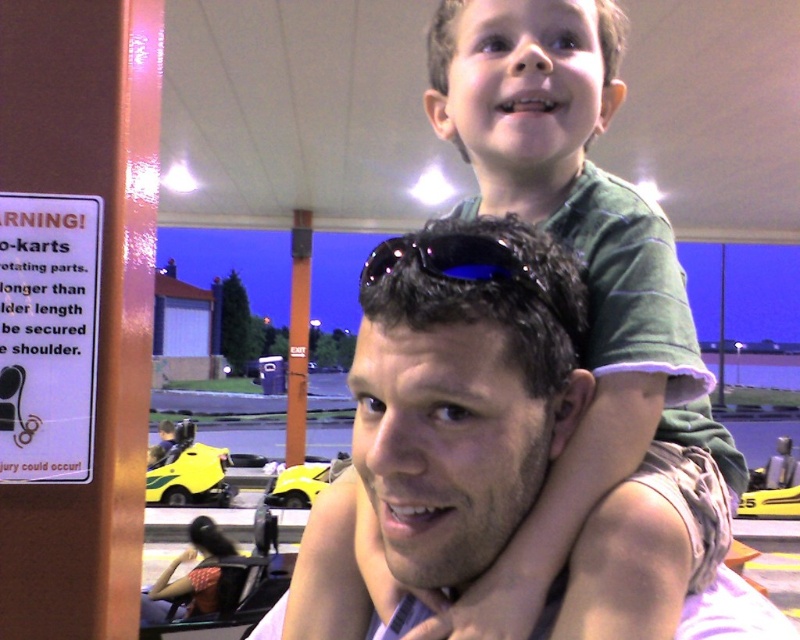
Question: Can you confirm if brown hair at upper center is positioned to the right of black reflective sunglasses at center?

Choices:
 (A) no
 (B) yes

Answer: (B)

Question: Which of these objects is positioned closest to the black reflective sunglasses at center?

Choices:
 (A) yellow plastic go-kart at center
 (B) yellow plastic go-kart at lower left
 (C) brown hair at upper center

Answer: (C)

Question: Does brown hair at upper center appear on the left side of yellow plastic go-kart at lower left?

Choices:
 (A) no
 (B) yes

Answer: (A)

Question: Does black reflective sunglasses at center have a greater width compared to yellow plastic go-kart at center?

Choices:
 (A) no
 (B) yes

Answer: (A)

Question: Which point is closer to the camera?

Choices:
 (A) (509, 228)
 (B) (454, 252)
 (C) (310, 497)

Answer: (B)

Question: Which object appears closest to the camera in this image?

Choices:
 (A) yellow plastic go-kart at lower left
 (B) black reflective sunglasses at center

Answer: (B)